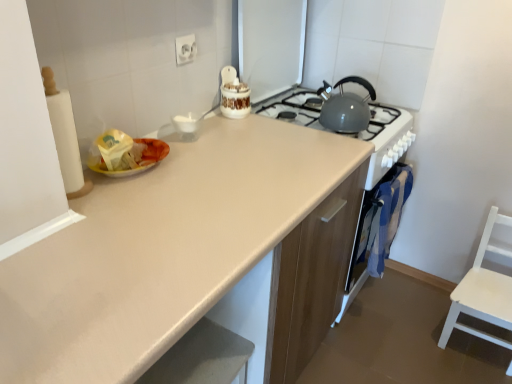
Question: Is white wood chair at right oriented towards white plastic electric outlet at upper center?

Choices:
 (A) yes
 (B) no

Answer: (B)

Question: From a real-world perspective, does white wood chair at right stand above white plastic electric outlet at upper center?

Choices:
 (A) yes
 (B) no

Answer: (B)

Question: Considering the relative sizes of white wood chair at right and white plastic electric outlet at upper center in the image provided, is white wood chair at right smaller than white plastic electric outlet at upper center?

Choices:
 (A) yes
 (B) no

Answer: (B)

Question: Is white wood chair at right turned away from white plastic electric outlet at upper center?

Choices:
 (A) no
 (B) yes

Answer: (A)

Question: Does white wood chair at right have a lesser width compared to white plastic electric outlet at upper center?

Choices:
 (A) no
 (B) yes

Answer: (A)

Question: Is white wood chair at right at the left side of white plastic electric outlet at upper center?

Choices:
 (A) no
 (B) yes

Answer: (A)

Question: Is white plastic electric outlet at upper center with blue fabric oven at right?

Choices:
 (A) no
 (B) yes

Answer: (A)

Question: From the image's perspective, does white plastic electric outlet at upper center appear higher than blue fabric oven at right?

Choices:
 (A) yes
 (B) no

Answer: (A)

Question: Can you confirm if white plastic electric outlet at upper center is positioned to the right of blue fabric oven at right?

Choices:
 (A) no
 (B) yes

Answer: (A)

Question: From a real-world perspective, is white plastic electric outlet at upper center physically above blue fabric oven at right?

Choices:
 (A) no
 (B) yes

Answer: (B)

Question: Considering the relative sizes of white plastic electric outlet at upper center and blue fabric oven at right in the image provided, is white plastic electric outlet at upper center shorter than blue fabric oven at right?

Choices:
 (A) no
 (B) yes

Answer: (B)

Question: Can you confirm if white plastic electric outlet at upper center is taller than blue fabric oven at right?

Choices:
 (A) no
 (B) yes

Answer: (A)

Question: Is matte beige countertop at center in front of white wood chair at right?

Choices:
 (A) no
 (B) yes

Answer: (B)